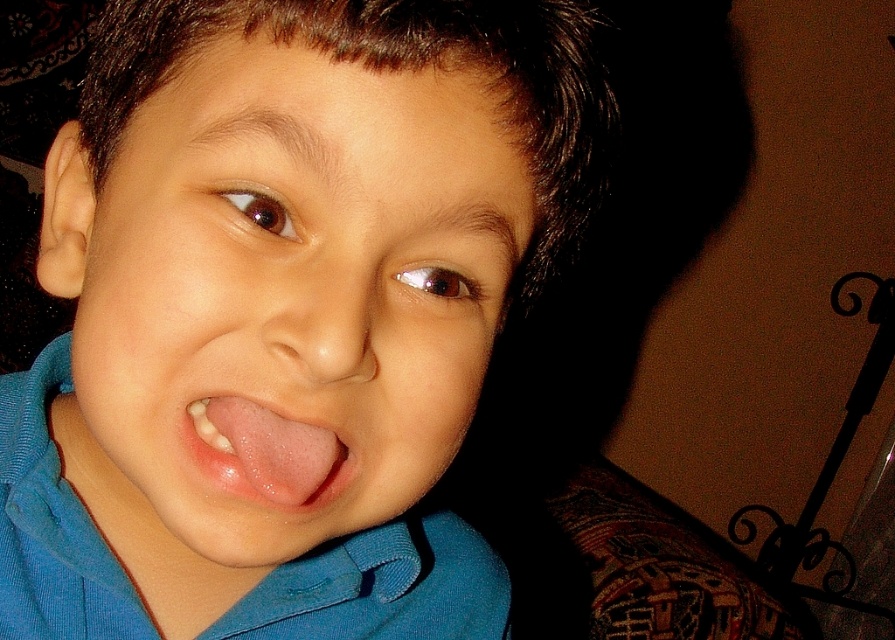
Who is positioned more to the left, smooth skin face at center or blue cotton polo shirt at center?

From the viewer's perspective, smooth skin face at center appears more on the left side.

Where is `smooth skin face at center`? The image size is (895, 640). smooth skin face at center is located at coordinates (288, 284).

Does point (197, 100) come farther from viewer compared to point (21, 404)?

No, (197, 100) is closer to viewer.

Where is `smooth skin face at center`? smooth skin face at center is located at coordinates (288, 284).

Can you confirm if smooth skin face at center is wider than pink smooth tongue at center?

Yes, smooth skin face at center is wider than pink smooth tongue at center.

Is smooth skin face at center positioned at the back of pink smooth tongue at center?

No, smooth skin face at center is in front of pink smooth tongue at center.

Consider the image. Who is more forward, (x=305, y=330) or (x=266, y=444)?

Positioned in front is point (x=305, y=330).

At what (x,y) coordinates should I click in order to perform the action: click on smooth skin face at center. Please return your answer as a coordinate pair (x, y). The image size is (895, 640). Looking at the image, I should click on (288, 284).

Who is lower down, blue cotton polo shirt at center or pink smooth tongue at center?

blue cotton polo shirt at center is below.

Is point (149, 637) farther from camera compared to point (278, 442)?

Yes, point (149, 637) is farther from viewer.

You are a GUI agent. You are given a task and a screenshot of the screen. Output one action in this format:
    pyautogui.click(x=<x>, y=<y>)
    Task: Click on the blue cotton polo shirt at center
    
    Given the screenshot: What is the action you would take?
    pyautogui.click(x=380, y=588)